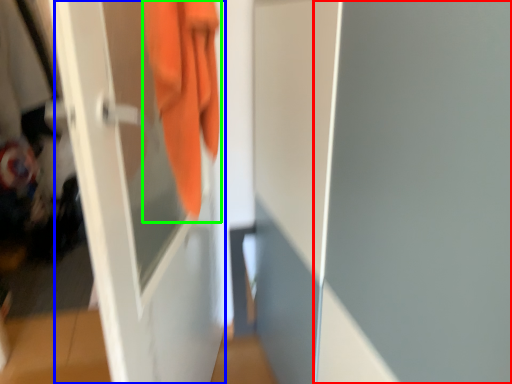
Question: Which object is the closest to the screen door (highlighted by a red box)? Choose among these: screen door (highlighted by a blue box) or towel (highlighted by a green box).

Choices:
 (A) screen door
 (B) towel

Answer: (B)